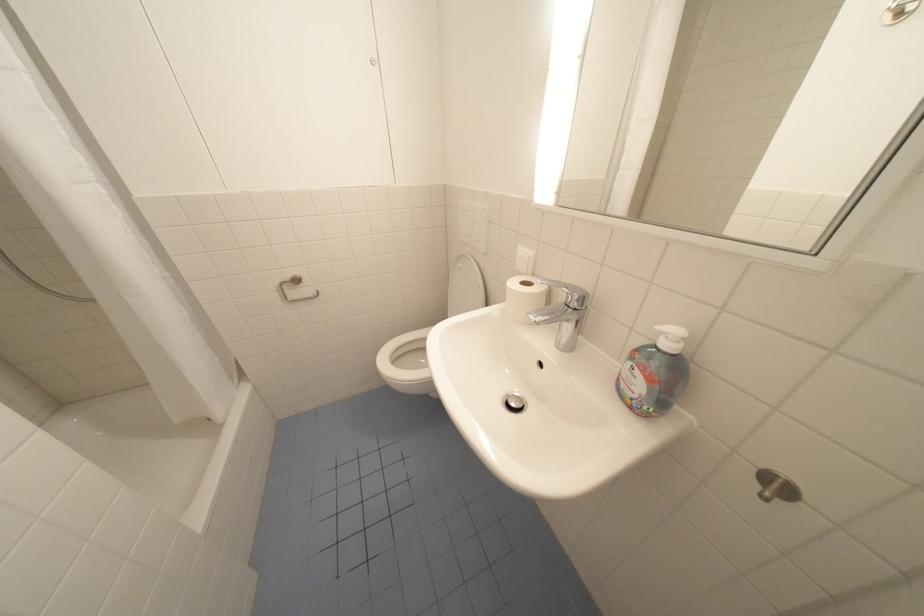
At what (x,y) coordinates should I click in order to perform the action: click on toilet paper holder. Please return your answer as a coordinate pair (x, y). Looking at the image, I should click on (524, 297).